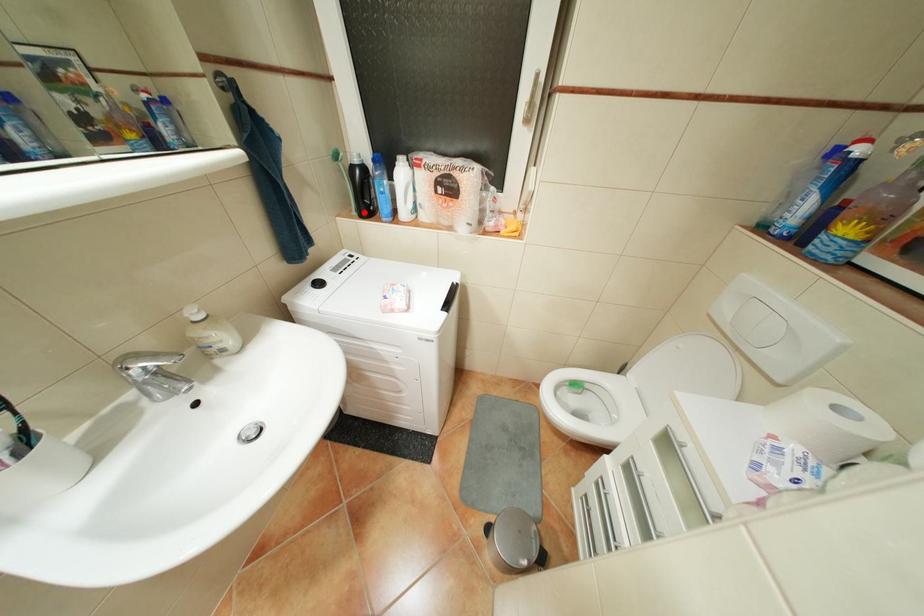
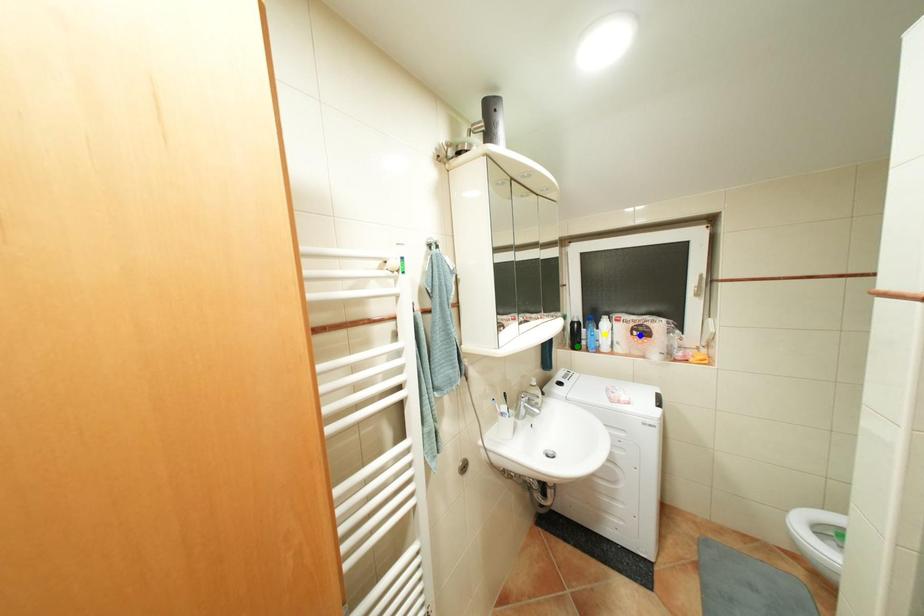
Question: I am providing you with two images of the same scene from different viewpoints. A red point is marked on the first image. You are given multiple points on the second image. Which mark in image 2 goes with the point in image 1?

Choices:
 (A) yellow point
 (B) green point
 (C) blue point

Answer: (B)